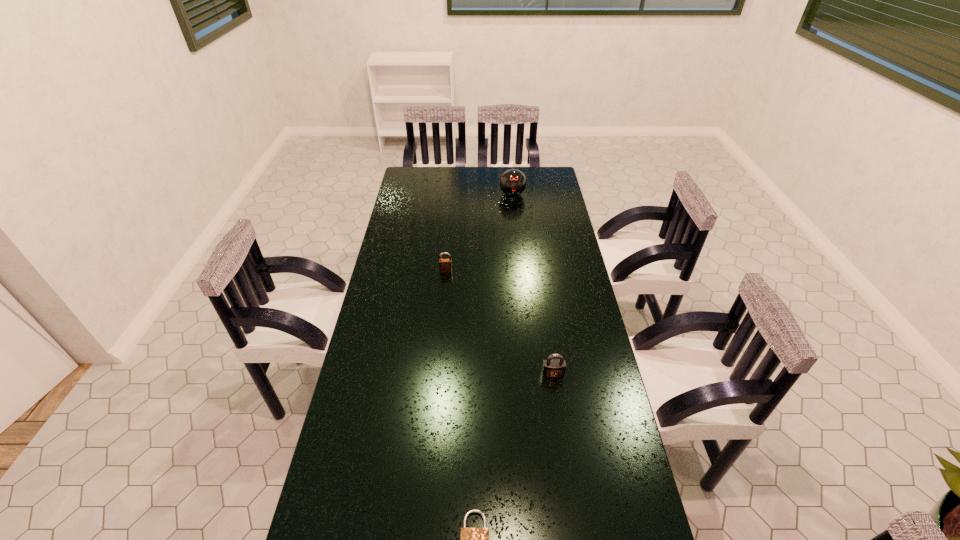
Locate an element on the screen. Image resolution: width=960 pixels, height=540 pixels. object that is at the right edge is located at coordinates (553, 368).

Image resolution: width=960 pixels, height=540 pixels. In the image, there is a desktop. In order to click on vacant space at the far edge in this screenshot , I will do `click(487, 175)`.

Where is `vacant space at the left edge of the desktop`? The width and height of the screenshot is (960, 540). vacant space at the left edge of the desktop is located at coordinates (390, 258).

This screenshot has width=960, height=540. In the image, there is a desktop. Find the location of `free space at the right edge`. free space at the right edge is located at coordinates (571, 383).

This screenshot has height=540, width=960. What are the coordinates of `free point at the far left corner` in the screenshot? It's located at (419, 174).

You are a GUI agent. You are given a task and a screenshot of the screen. Output one action in this format:
    pyautogui.click(x=<x>, y=<y>)
    Task: Click on the vacant point located between the farthest object and the leftmost object
    The width and height of the screenshot is (960, 540).
    Given the screenshot: What is the action you would take?
    pyautogui.click(x=479, y=233)

This screenshot has height=540, width=960. Find the location of `unoccupied area between the tallest object and the rightmost padlock`. unoccupied area between the tallest object and the rightmost padlock is located at coordinates (533, 284).

Where is `vacant area between the bowling ball and the second nearest object`? vacant area between the bowling ball and the second nearest object is located at coordinates (533, 284).

Locate an element on the screen. This screenshot has width=960, height=540. free space between the third nearest object and the second farthest padlock is located at coordinates tap(499, 322).

Locate which object is the second closest to the nearest padlock. Please provide its 2D coordinates. Your answer should be formatted as a tuple, i.e. [(x, y)], where the tuple contains the x and y coordinates of a point satisfying the conditions above.

[(445, 265)]